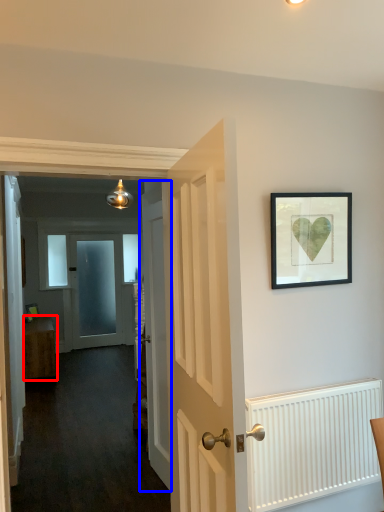
Question: Which object is further to the camera taking this photo, furniture (highlighted by a red box) or door (highlighted by a blue box)?

Choices:
 (A) furniture
 (B) door

Answer: (A)